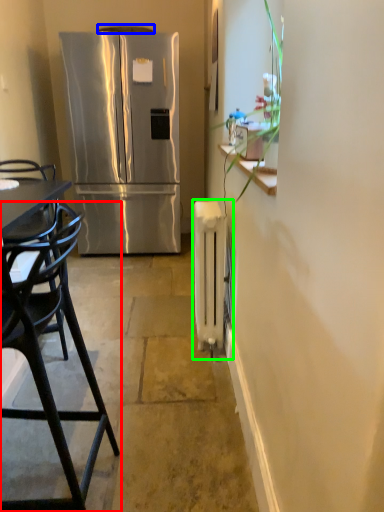
Question: Considering the real-world distances, which object is farthest from chair (highlighted by a red box)? exhaust hood (highlighted by a blue box) or radiator (highlighted by a green box)?

Choices:
 (A) exhaust hood
 (B) radiator

Answer: (A)